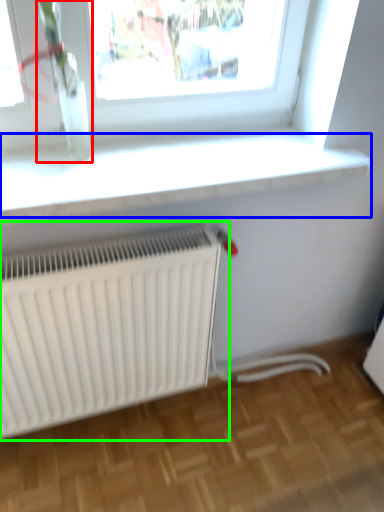
Question: Estimate the real-world distances between objects in this image. Which object is closer to plant (highlighted by a red box), window sill (highlighted by a blue box) or radiator (highlighted by a green box)?

Choices:
 (A) window sill
 (B) radiator

Answer: (A)